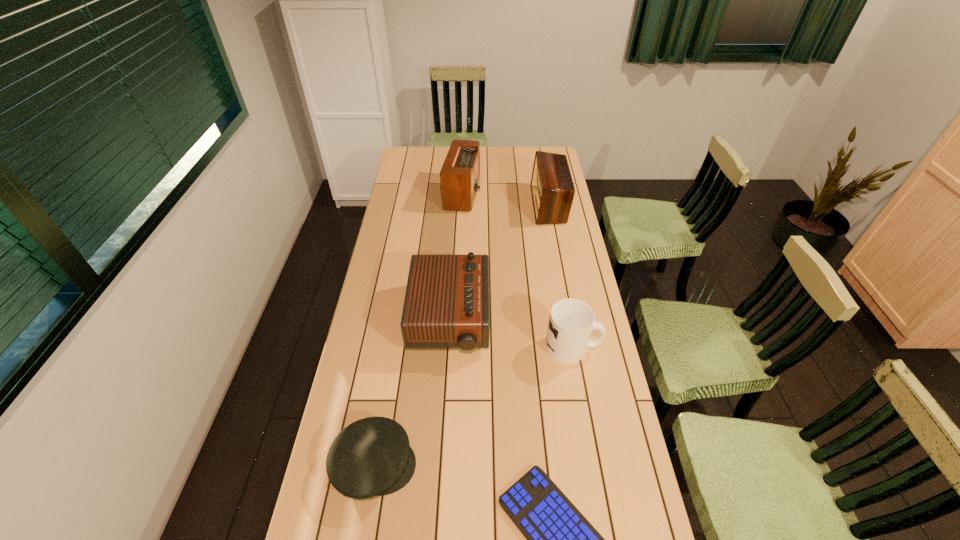
This screenshot has width=960, height=540. I want to click on vacant region between the nearest radio receiver and the mug, so click(x=511, y=333).

Image resolution: width=960 pixels, height=540 pixels. I want to click on object identified as the fifth closest to the rightmost radio receiver, so click(560, 539).

Where is `object that stands as the closest to the mug`? The width and height of the screenshot is (960, 540). object that stands as the closest to the mug is located at coordinates (446, 305).

Image resolution: width=960 pixels, height=540 pixels. In order to click on radio receiver that is the closest to the nearest radio receiver in this screenshot , I will do `click(552, 188)`.

Locate which radio receiver ranks second in proximity to the rightmost radio receiver. Please provide its 2D coordinates. Your answer should be formatted as a tuple, i.e. [(x, y)], where the tuple contains the x and y coordinates of a point satisfying the conditions above.

[(446, 305)]